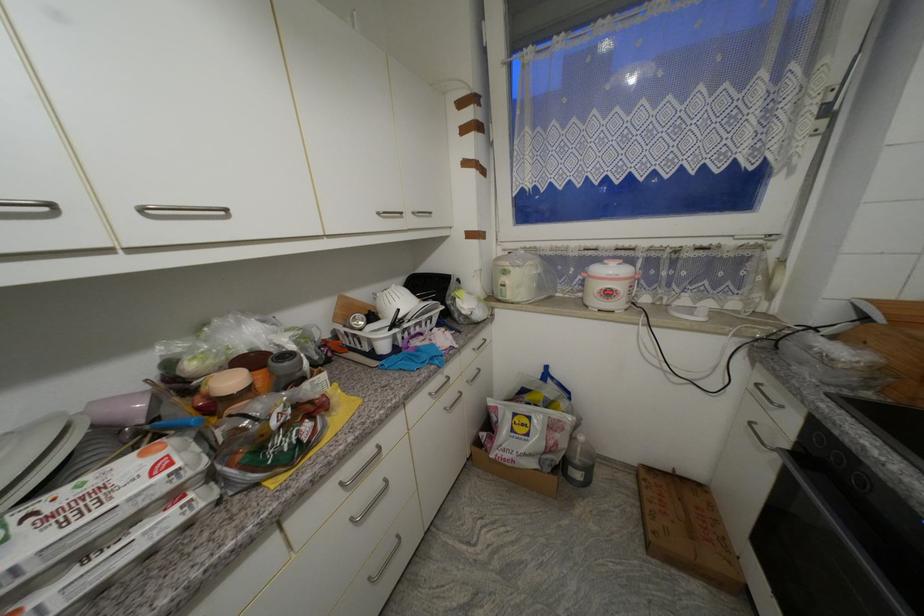
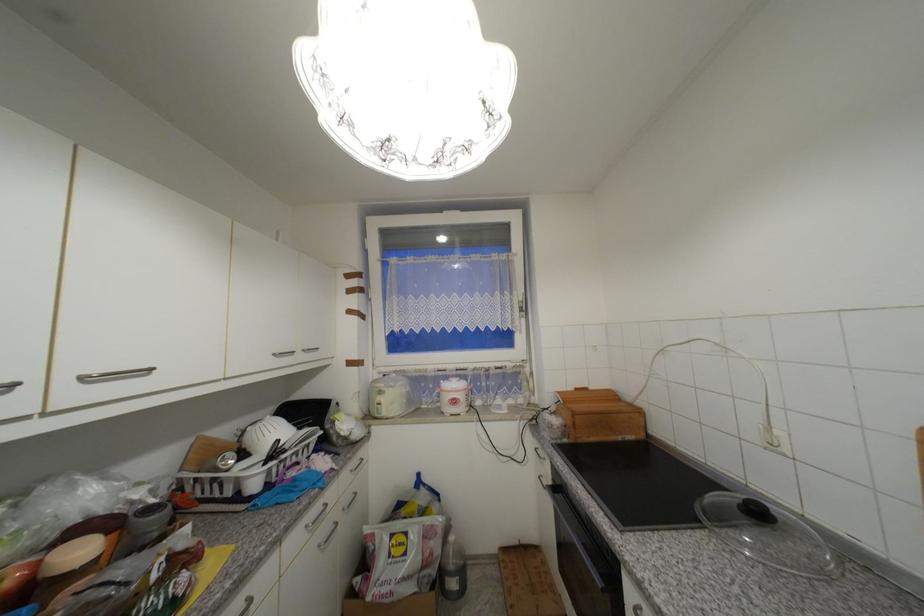
Locate, in the second image, the point that corresponds to (x=793, y=447) in the first image.

(555, 485)